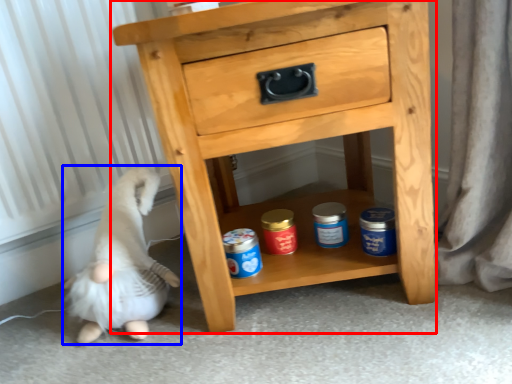
Question: Which of the following is the closest to the observer, chest of drawers (highlighted by a red box) or animal (highlighted by a blue box)?

Choices:
 (A) chest of drawers
 (B) animal

Answer: (A)